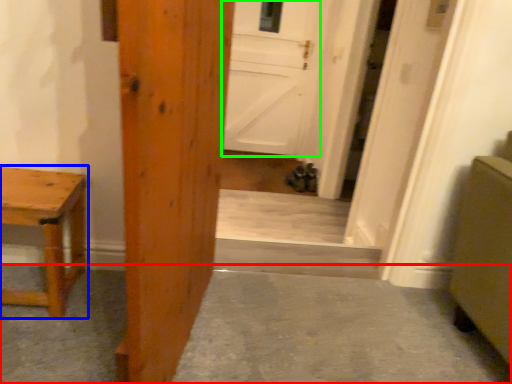
Question: Which is farther away from concrete (highlighted by a red box)? table (highlighted by a blue box) or door (highlighted by a green box)?

Choices:
 (A) table
 (B) door

Answer: (B)